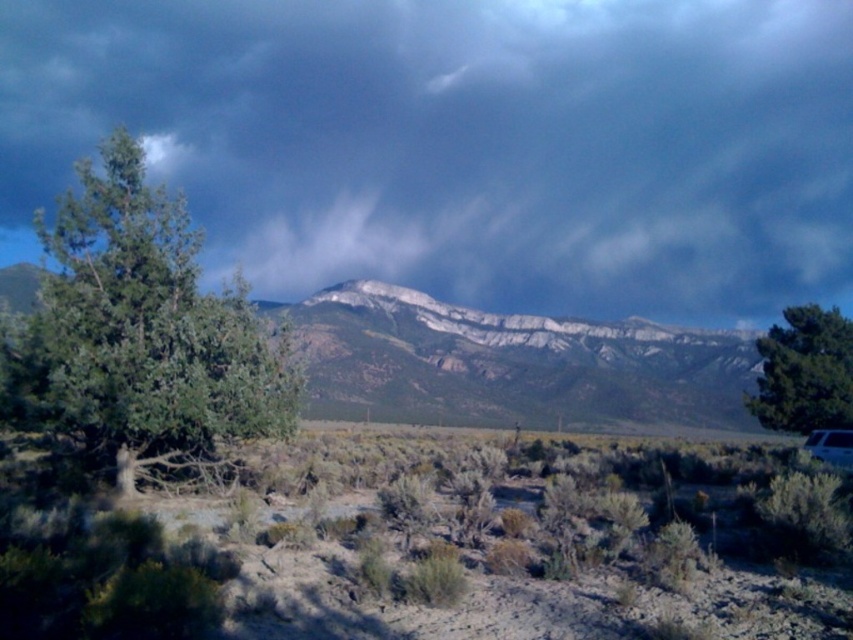
Is green shrubbery at center thinner than green leafy tree at right?

No, green shrubbery at center is not thinner than green leafy tree at right.

Who is taller, green shrubbery at center or green leafy tree at right?

With more height is green leafy tree at right.

Is point (502, 515) positioned after point (775, 381)?

No.

Where is `green shrubbery at center`? Image resolution: width=853 pixels, height=640 pixels. green shrubbery at center is located at coordinates (437, 545).

In the scene shown: Can you confirm if green shrubbery at center is smaller than white plastic recreational vehicle at lower right?

No, green shrubbery at center is not smaller than white plastic recreational vehicle at lower right.

Which is below, green shrubbery at center or white plastic recreational vehicle at lower right?

green shrubbery at center is lower down.

Who is more forward, (544, 472) or (845, 449)?

Point (845, 449) is more forward.

This screenshot has width=853, height=640. I want to click on green shrubbery at center, so click(x=437, y=545).

Who is more distant from viewer, (721,412) or (833,451)?

Positioned behind is point (721,412).

Is rocky gray mountain range at center smaller than white plastic recreational vehicle at lower right?

Actually, rocky gray mountain range at center might be larger than white plastic recreational vehicle at lower right.

Who is more forward, (x=418, y=304) or (x=834, y=461)?

Positioned in front is point (x=834, y=461).

Where is `rocky gray mountain range at center`? This screenshot has height=640, width=853. rocky gray mountain range at center is located at coordinates (509, 364).